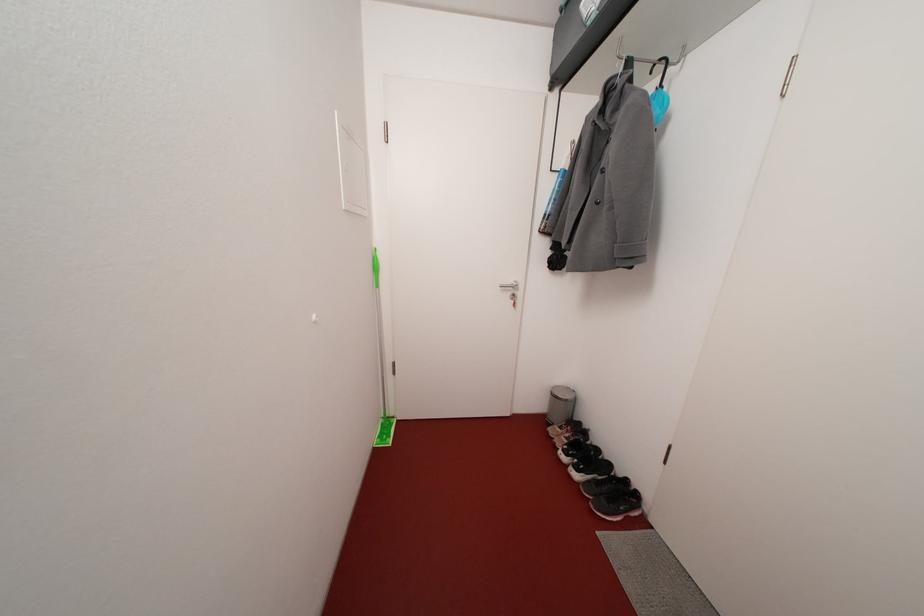
The height and width of the screenshot is (616, 924). Describe the element at coordinates (512, 291) in the screenshot. I see `the silver door handle` at that location.